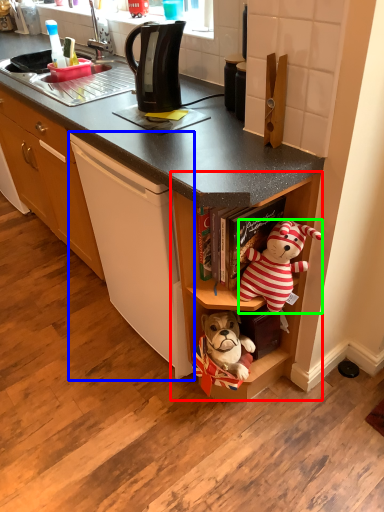
Question: Which object is positioned closest to shelf (highlighted by a red box)? Select from cording machine (highlighted by a blue box) and teddy bear (highlighted by a green box).

Choices:
 (A) cording machine
 (B) teddy bear

Answer: (B)